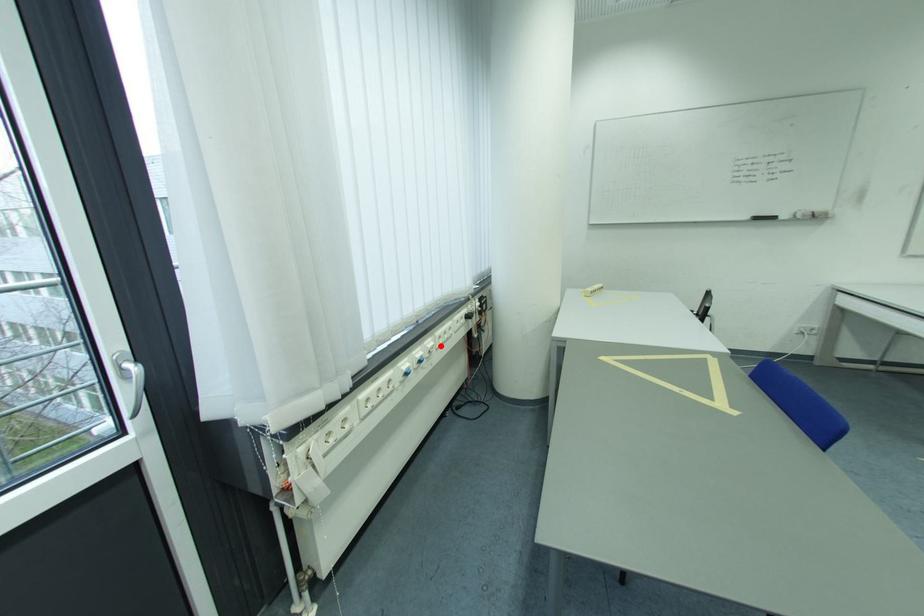
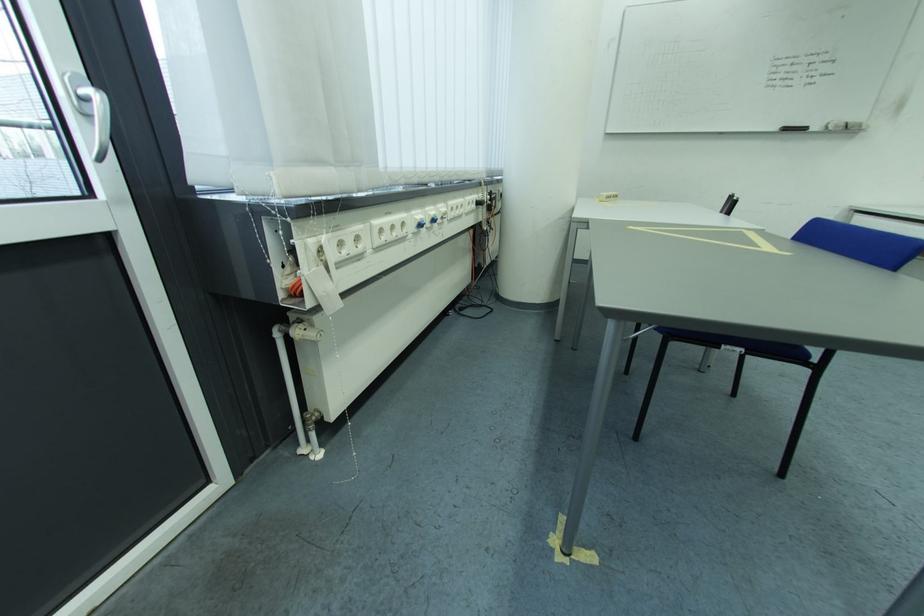
The point at the highlighted location is marked in the first image. Where is the corresponding point in the second image?

(454, 212)